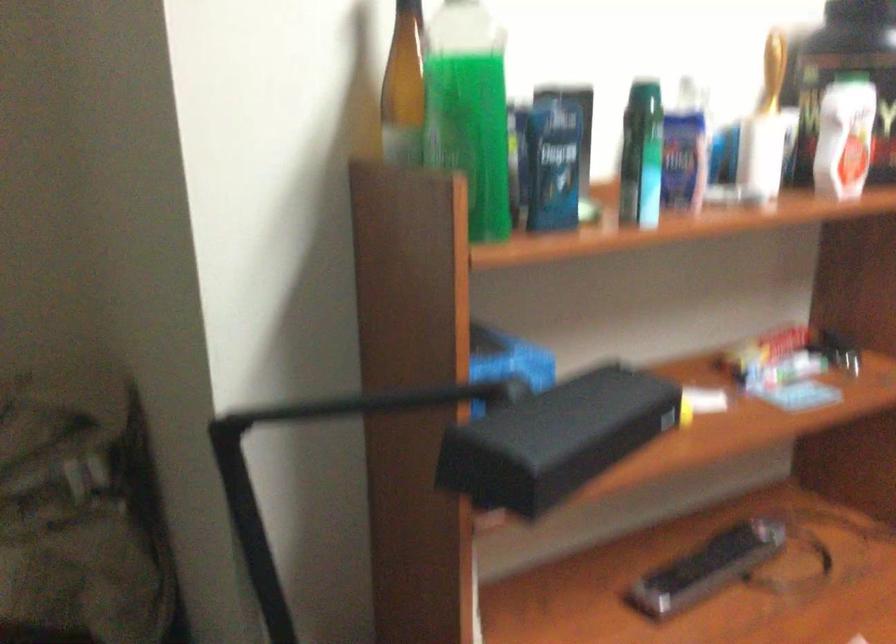
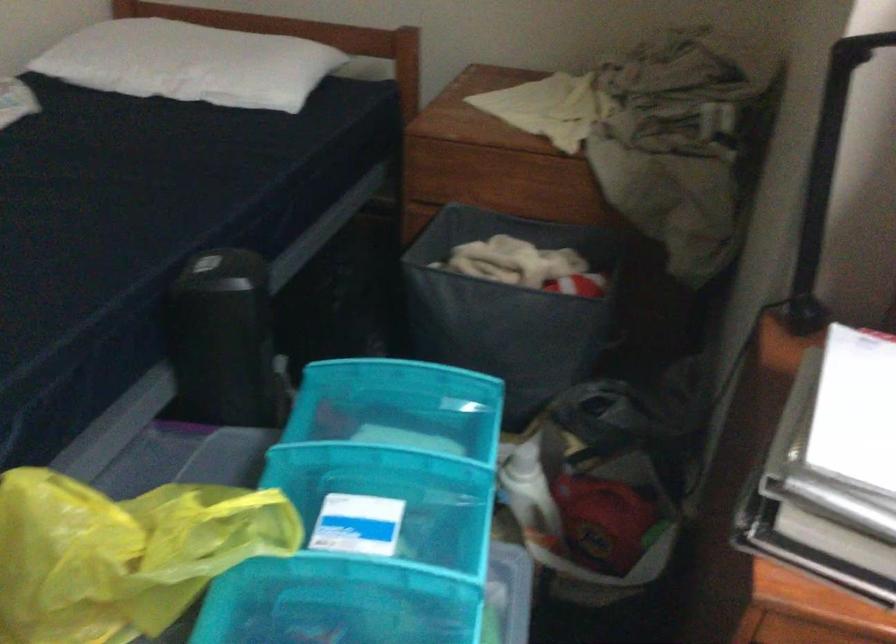
Based on the continuous images, in which direction is the camera rotating?

The rotation direction of the camera is left-down.